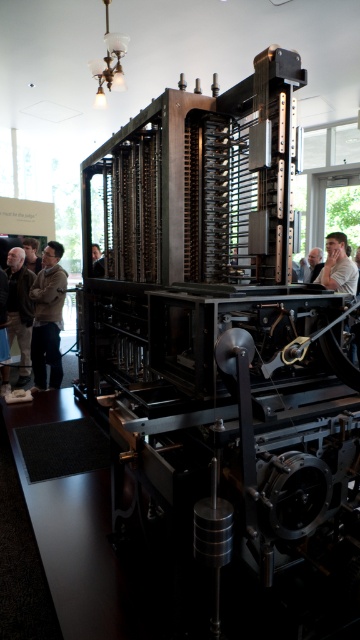
You are a tour guide explaining the mechanical device to visitors. You notice two jackets left behind near the machine. The jackets are the brown leather jacket at left and the light brown leather jacket at center. A visitor asks which jacket is closer to the entrance, which is located behind the machine. Can you determine this based on their positions?

The brown leather jacket at left is 10.39 feet away from the light brown leather jacket at center. Since the entrance is behind the machine, the distance from each jacket to the entrance depends on their positions relative to the back of the machine. However, without knowing the exact location of each jacket relative to the entrance, it is impossible to determine which is closer. Please check their positions from the entrance side.

You are a security guard in the museum and need to place a barrier between the dark brown leather jacket at lower left and the light brown leather jacket at center to prevent visitors from touching the machinery. Which jacket requires the barrier to be closer to the machinery?

The dark brown leather jacket at lower left requires the barrier to be closer to the machinery because it might be wider than the light brown leather jacket at center, so the barrier needs to account for its width to ensure safety.

You are standing in front of the mechanical device and see two jackets. The dark brown leather jacket at lower left and the light brown leather jacket at center. Which jacket is closer to the ground?

The dark brown leather jacket at lower left is closer to the ground because it is positioned below the light brown leather jacket at center.